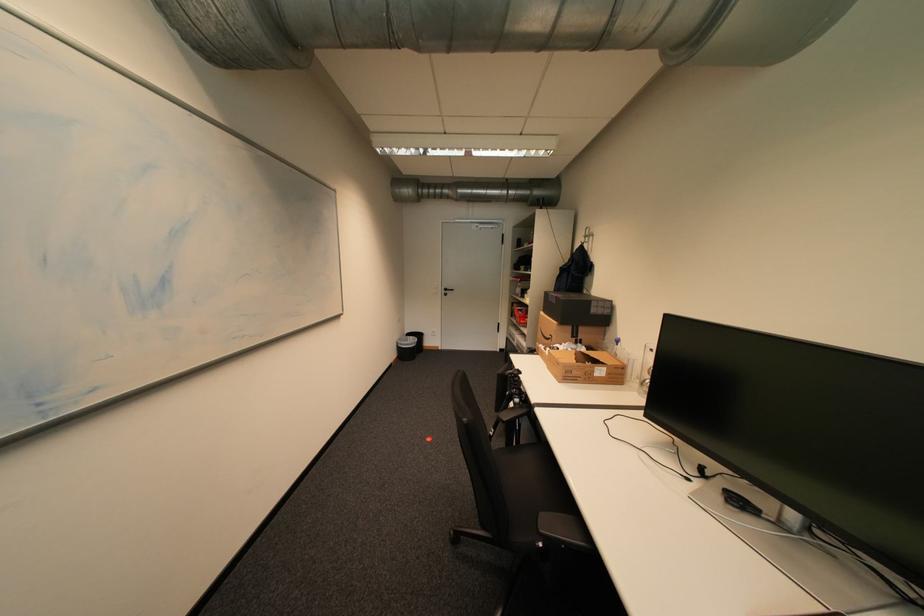
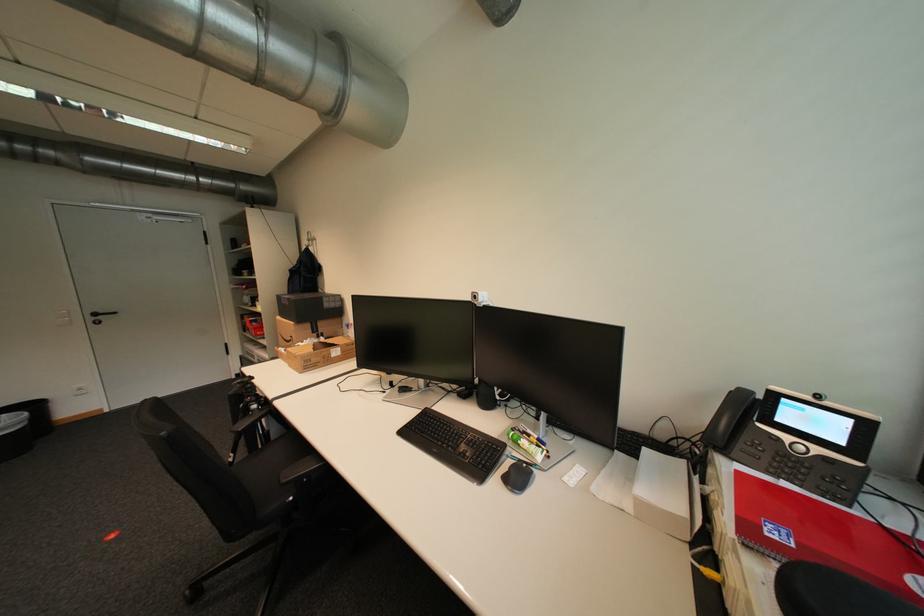
The point at (455, 290) is marked in the first image. Where is the corresponding point in the second image?

(103, 315)